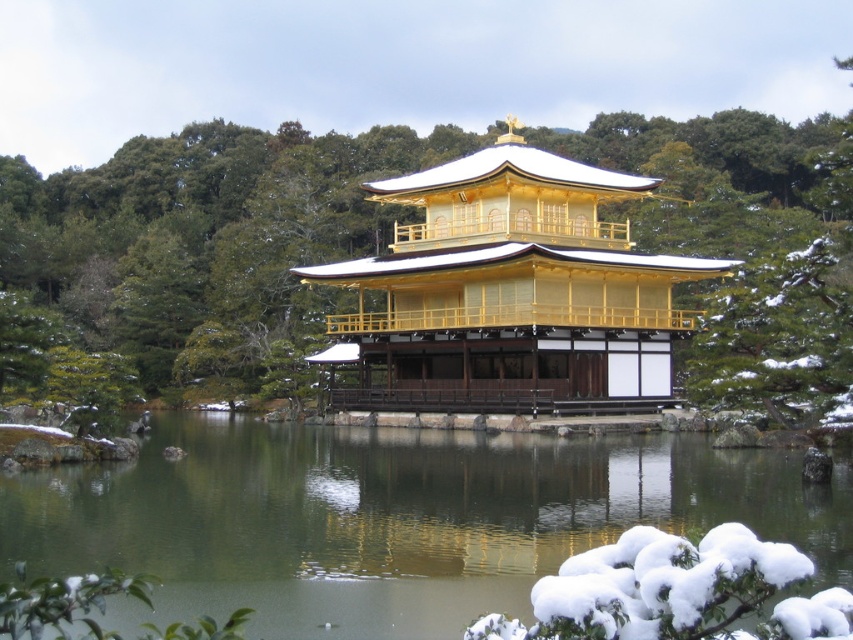
The height and width of the screenshot is (640, 853). Describe the element at coordinates (445, 269) in the screenshot. I see `green matte tree at center` at that location.

This screenshot has width=853, height=640. Find the location of `green matte tree at center`. green matte tree at center is located at coordinates (445, 269).

Find the location of a particular element. The image size is (853, 640). green matte tree at center is located at coordinates (445, 269).

Which is below, glossy reflective water at center or gold/polished wood palace at center?

glossy reflective water at center is lower down.

Is point (15, 545) more distant than point (524, 202)?

No, it is in front of (524, 202).

Consider the image. Measure the distance between glossy reflective water at center and camera.

glossy reflective water at center and camera are 77.43 feet apart from each other.

Find the location of a particular element. Image resolution: width=853 pixels, height=640 pixels. glossy reflective water at center is located at coordinates (392, 518).

Is the position of green matte tree at center more distant than that of glossy reflective water at center?

Yes.

Between green matte tree at center and glossy reflective water at center, which one has less height?

Standing shorter between the two is glossy reflective water at center.

Describe the element at coordinates (445, 269) in the screenshot. I see `green matte tree at center` at that location.

Image resolution: width=853 pixels, height=640 pixels. Identify the location of green matte tree at center. (445, 269).